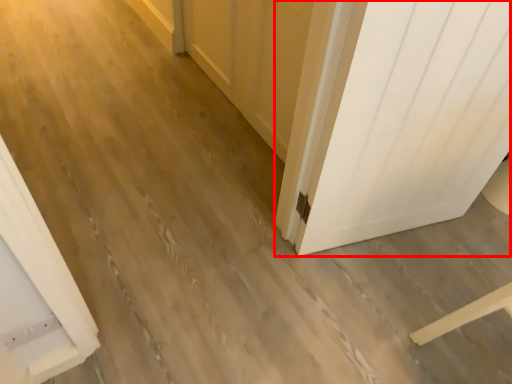
Question: Observing the image, what is the correct spatial positioning of door (annotated by the red box) in reference to barn door?

Choices:
 (A) right
 (B) left

Answer: (A)